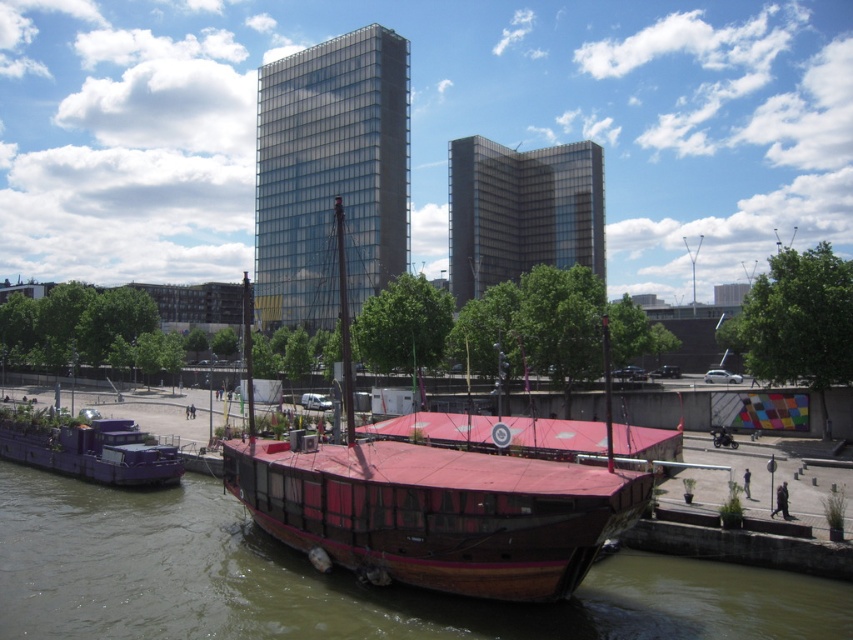
Question: Estimate the real-world distances between objects in this image. Which object is farther from the purple matte houseboat at lower left?

Choices:
 (A) brown wooden boat at center
 (B) wooden boat at center

Answer: (B)

Question: Does brown wooden boat at center have a lesser width compared to purple matte houseboat at lower left?

Choices:
 (A) yes
 (B) no

Answer: (B)

Question: Does brown wooden boat at center appear on the left side of purple matte houseboat at lower left?

Choices:
 (A) no
 (B) yes

Answer: (A)

Question: Considering the real-world distances, which object is farthest from the purple matte houseboat at lower left?

Choices:
 (A) brown wooden boat at center
 (B) wooden boat at center

Answer: (B)

Question: Is brown wooden boat at center closer to camera compared to wooden boat at center?

Choices:
 (A) yes
 (B) no

Answer: (B)

Question: Which object is closer to the camera taking this photo?

Choices:
 (A) purple matte houseboat at lower left
 (B) wooden boat at center

Answer: (B)